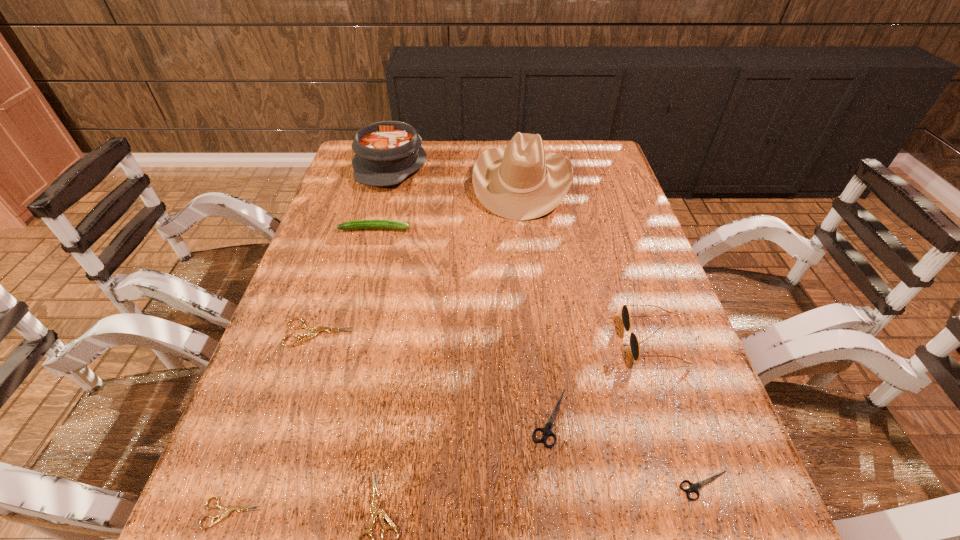
What are the coordinates of `zucchini that is at the left edge` in the screenshot? It's located at (356, 224).

Find the location of a particular element. The width and height of the screenshot is (960, 540). cowboy hat situated at the right edge is located at coordinates (521, 182).

The image size is (960, 540). What are the coordinates of `sunglasses situated at the right edge` in the screenshot? It's located at (634, 344).

I want to click on shears present at the right edge, so click(694, 487).

Locate an element on the screen. object that is at the far left corner is located at coordinates (386, 153).

Locate an element on the screen. This screenshot has height=540, width=960. object situated at the near left corner is located at coordinates (229, 509).

Locate an element on the screen. object situated at the far right corner is located at coordinates point(521,182).

What are the coordinates of `free space at the far edge of the desktop` in the screenshot? It's located at (412, 176).

The height and width of the screenshot is (540, 960). In the image, there is a desktop. Identify the location of vacant space at the left edge. (317, 256).

The width and height of the screenshot is (960, 540). I want to click on free location at the right edge of the desktop, so click(x=593, y=231).